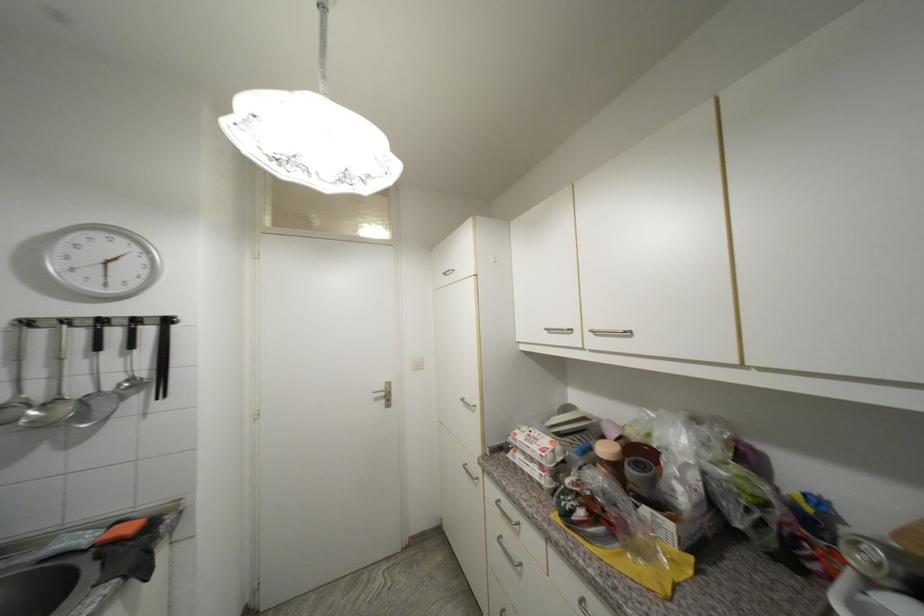
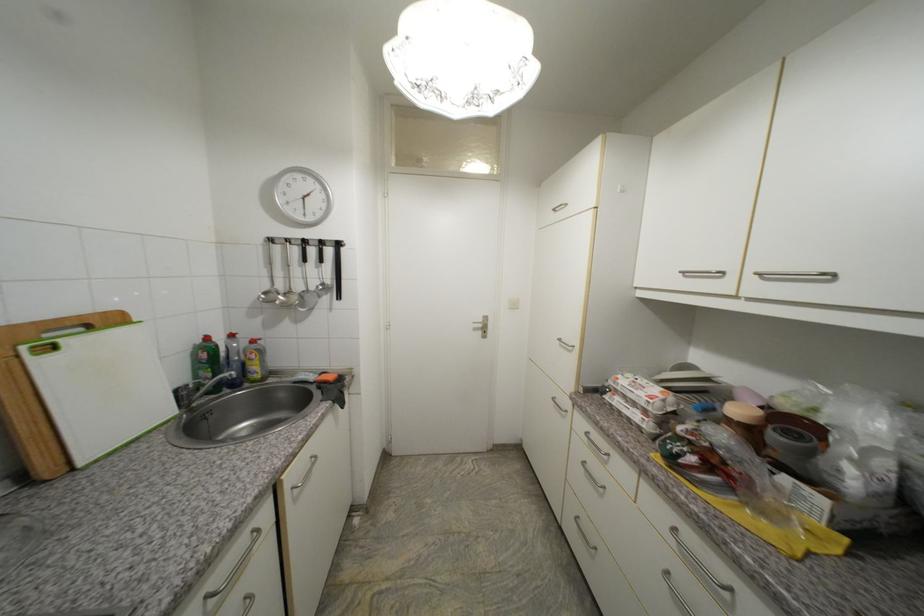
Question: The camera is either moving clockwise (left) or counter-clockwise (right) around the object. The first image is from the beginning of the video and the second image is from the end. Is the camera moving left or right when shooting the video?

Choices:
 (A) Left
 (B) Right

Answer: (B)